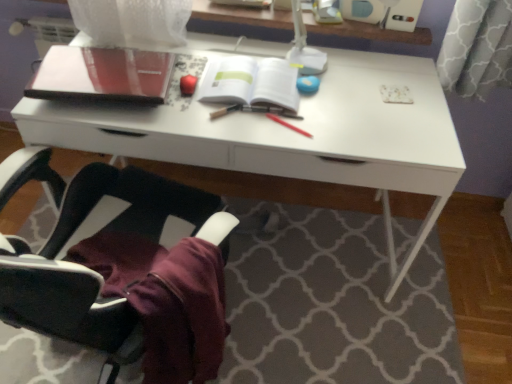
Locate an element on the screen. The height and width of the screenshot is (384, 512). vacant space situated on the left part of glossy red apple at upper center, marked as the third stationery in a right-to-left arrangement is located at coordinates (153, 103).